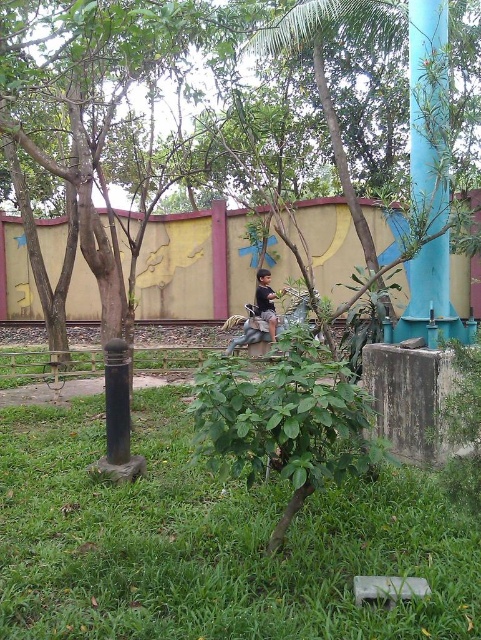
You are a painter who needs to place a new sign. The sign is exactly the same size as the black cotton shirt at center. Can the sign fit on the blue glossy pole at upper right without overlapping?

The blue glossy pole at upper right is bigger than the black cotton shirt at center, so yes, the sign can fit on the blue glossy pole at upper right without overlapping.

You are a child trying to find a spot to play with a ball in the park. You see the green grass at lower center and the blue glossy pole at upper right. Which area would be better for playing, and why?

The green grass at lower center is better for playing because it is located below the blue glossy pole at upper right, which means it is a flat open area suitable for ball games.

You are a photographer trying to capture both the green grass at lower center and the black cotton shirt at center in a single frame. Which object should you focus on first to ensure both are in the shot?

The green grass at lower center has a larger size compared to the black cotton shirt at center, so focusing on the larger green grass at lower center first will help ensure both objects are included in the frame.